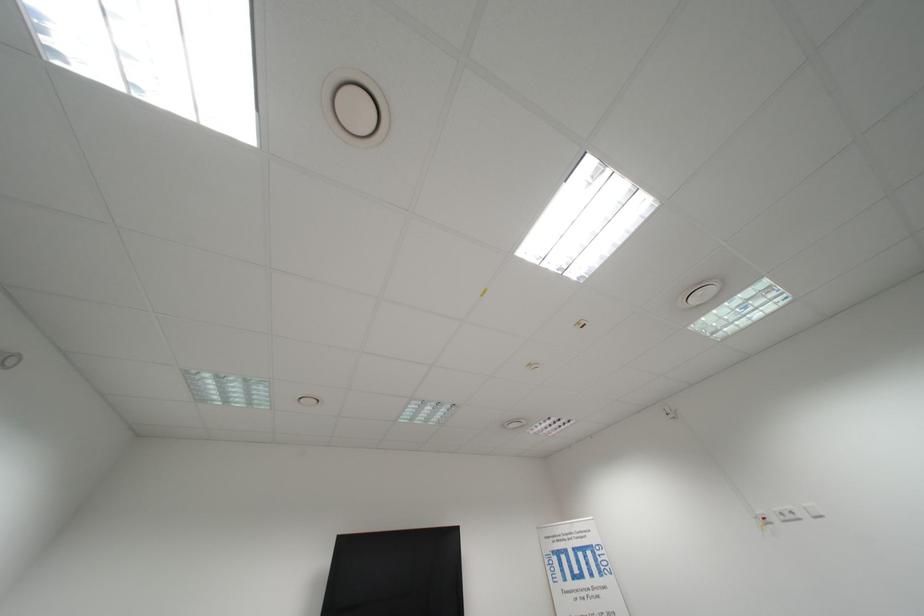
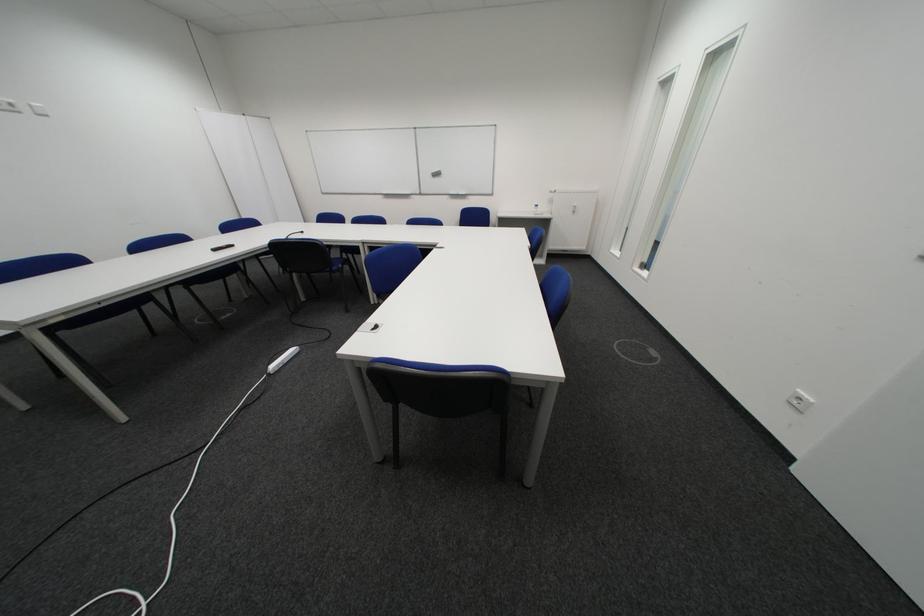
Locate, in the second image, the point that corresponds to point 796,519 in the first image.

(8, 108)